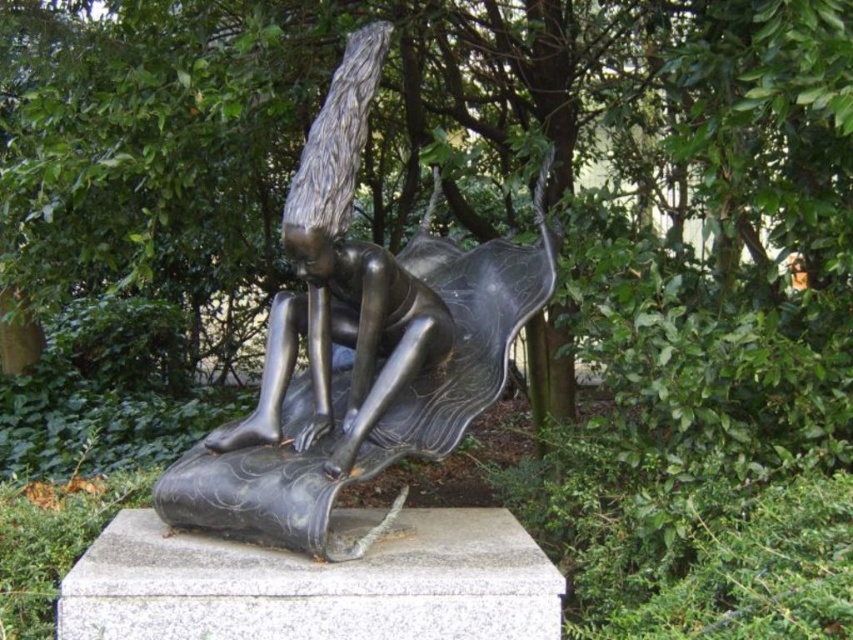
Question: Observing the image, what is the correct spatial positioning of polished bronze statue at center in reference to shiny bronze figure at center?

Choices:
 (A) right
 (B) left

Answer: (A)

Question: Can you confirm if polished bronze statue at center is positioned below shiny bronze figure at center?

Choices:
 (A) no
 (B) yes

Answer: (A)

Question: Among these objects, which one is farthest from the camera?

Choices:
 (A) polished bronze statue at center
 (B) shiny bronze figure at center

Answer: (B)

Question: Is polished bronze statue at center closer to camera compared to shiny bronze figure at center?

Choices:
 (A) yes
 (B) no

Answer: (A)